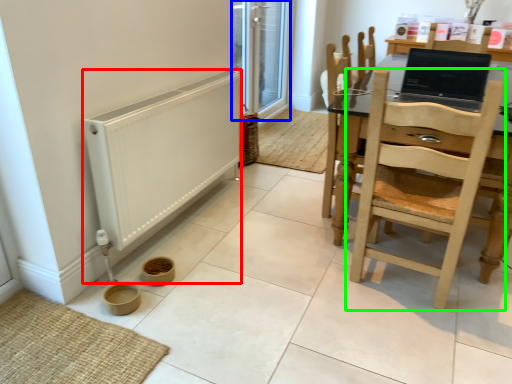
Question: Considering the real-world distances, which object is farthest from heater (highlighted by a red box)? screen door (highlighted by a blue box) or chair (highlighted by a green box)?

Choices:
 (A) screen door
 (B) chair

Answer: (A)